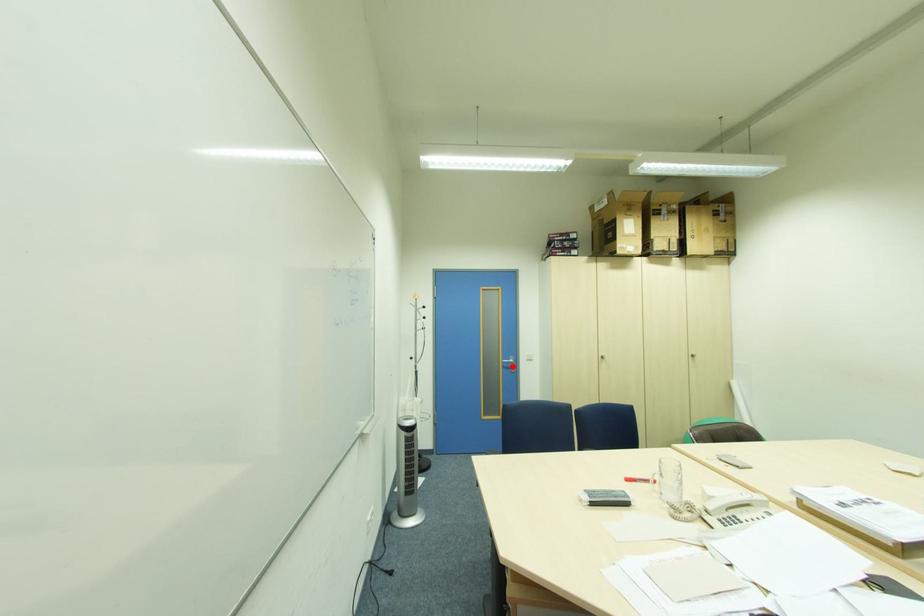
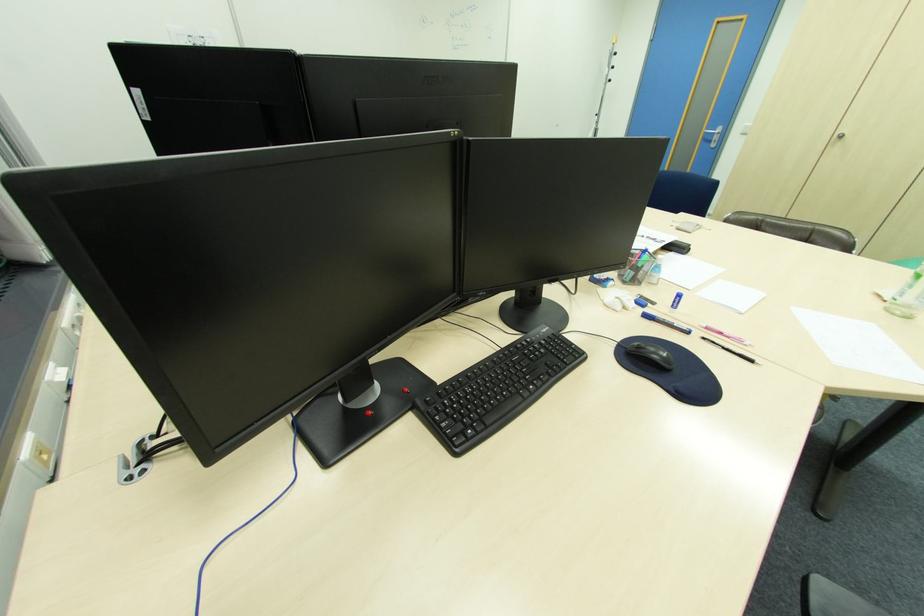
In the second image, find the point that corresponds to the highlighted location in the first image.

(713, 139)